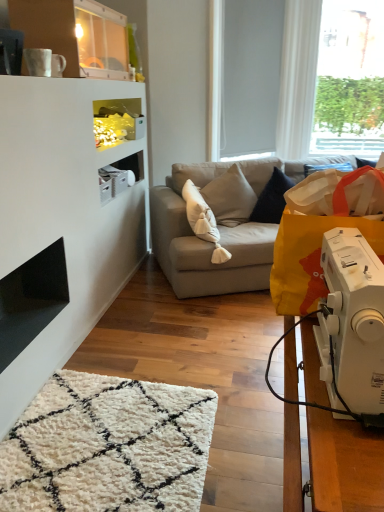
Question: Looking at their shapes, would you say light gray fabric couch at center is wider or thinner than white plastic sewing machine at lower right?

Choices:
 (A) wide
 (B) thin

Answer: (A)

Question: From a real-world perspective, relative to white plastic sewing machine at lower right, is light gray fabric couch at center vertically above or below?

Choices:
 (A) below
 (B) above

Answer: (A)

Question: Based on their relative distances, which object is farther from the white matte window screen at upper right?

Choices:
 (A) translucent glass shelf at upper center
 (B) yellow paper grocery bag at right
 (C) black glossy fireplace at lower left
 (D) transparent glass window at upper right
 (E) light gray fabric couch at center

Answer: (B)

Question: Which of these objects is positioned closest to the white matte window screen at upper right?

Choices:
 (A) beige fabric pillow at center
 (B) light gray fabric couch at center
 (C) yellow paper grocery bag at right
 (D) white plastic sewing machine at lower right
 (E) translucent glass shelf at upper center

Answer: (B)